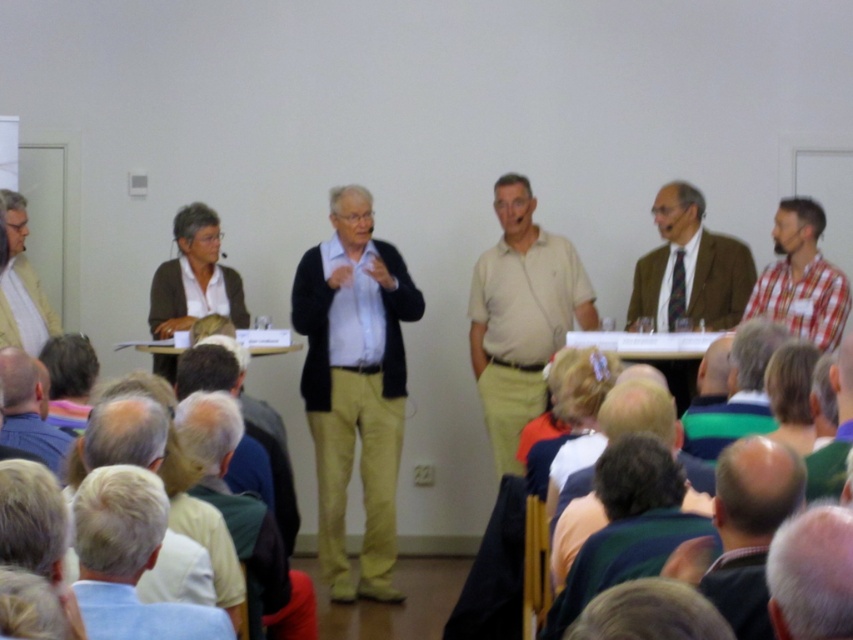
You are a photographer standing behind the matte brown suit at center, and you want to capture a closeup shot of the white matte hair at lower left. Given that your camera has a maximum zoom range of 2 meters, can you get a clear closeup without moving closer?

The distance between the white matte hair at lower left and the matte brown suit at center is 3.65 meters. Since the camera can only zoom up to 2 meters, you cannot capture a clear closeup without moving closer.

You are a photographer standing at the back of the room. You want to take a clear photo of the light beige cotton pants at center. Considering the distance, can you focus on the pants without moving closer?

The light beige cotton pants at center are 16.77 feet away from the camera. Since this distance is within the typical focusing range of most cameras, you can likely focus on the pants without moving closer.

You are a photographer at the back of the room. You want to take a photo of the panelists. The light beige cotton pants at center and the fluffy pink fur at lower right are both in your camera frame. Which object will appear larger in your photo?

The light beige cotton pants at center will appear larger in the photo because it is closer to the camera than the fluffy pink fur at lower right.